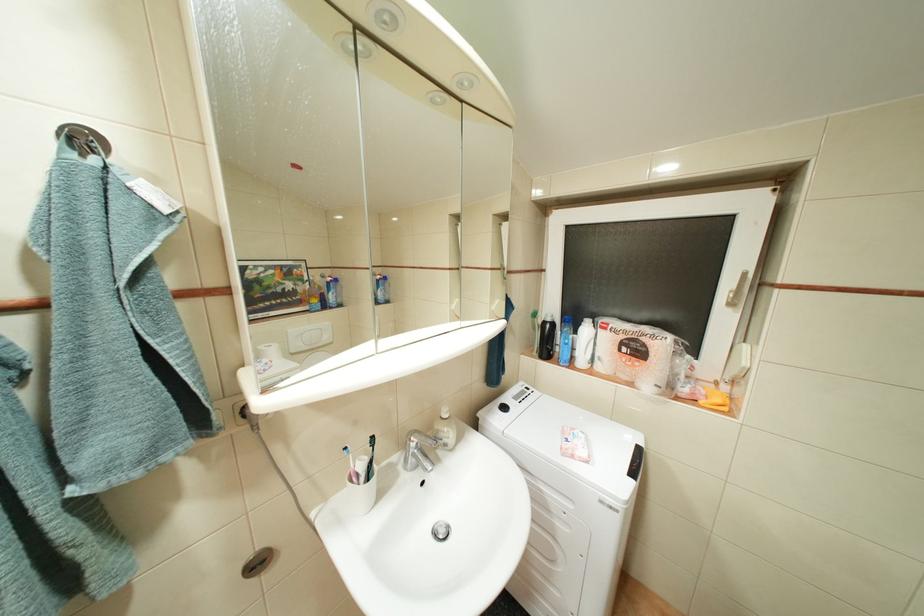
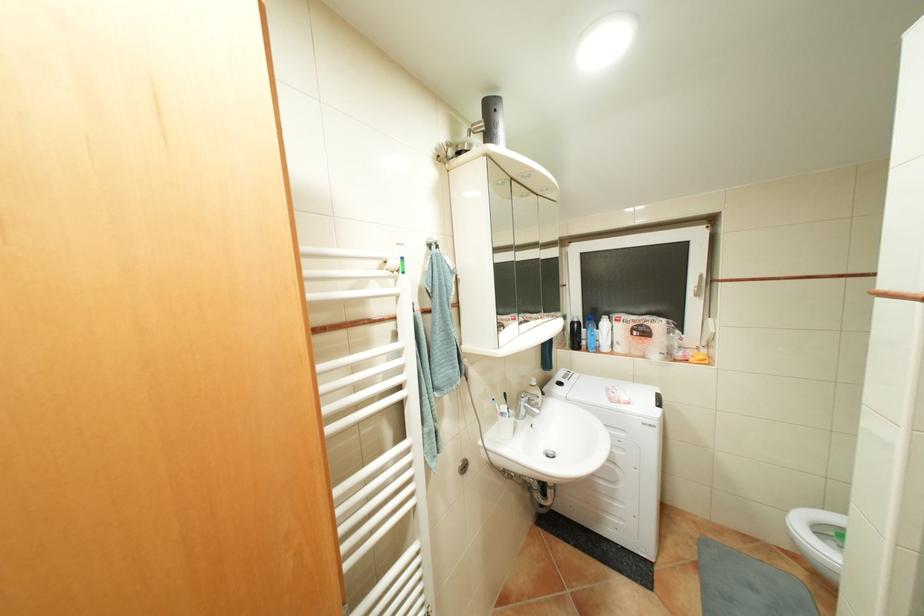
In the second image, find the point that corresponds to pixel 742 304 in the first image.

(707, 294)